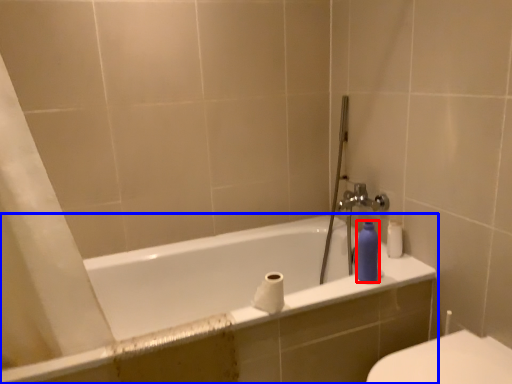
Question: Which of the following is the closest to the observer, toiletry (highlighted by a red box) or bathtub (highlighted by a blue box)?

Choices:
 (A) toiletry
 (B) bathtub

Answer: (B)